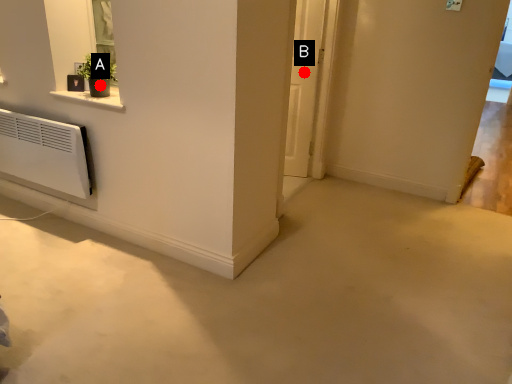
Question: Two points are circled on the image, labeled by A and B beside each circle. Which point is closer to the camera?

Choices:
 (A) A is closer
 (B) B is closer

Answer: (A)